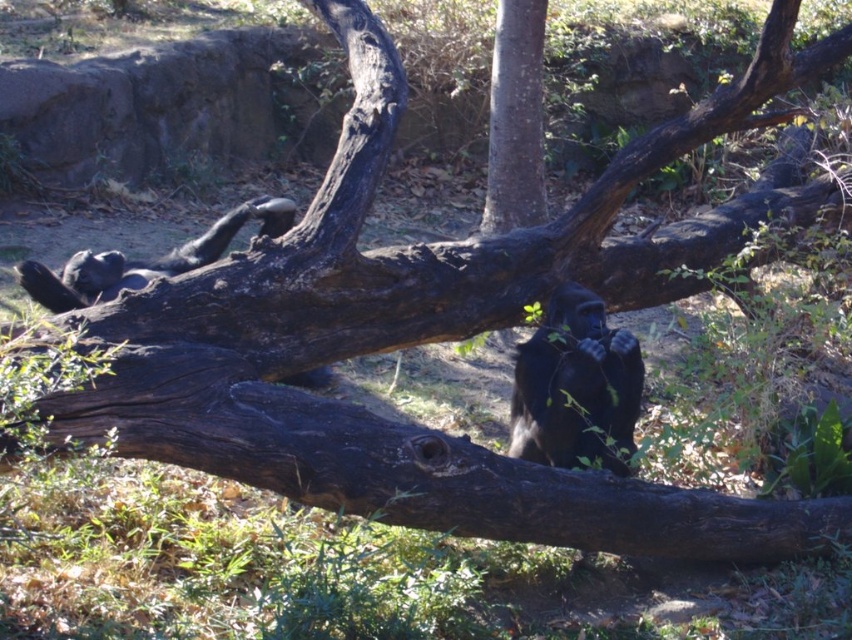
This screenshot has width=852, height=640. In order to click on shiny black ape at center in this screenshot , I will do `click(574, 387)`.

Describe the element at coordinates (574, 387) in the screenshot. I see `shiny black ape at center` at that location.

Which is in front, point (620, 358) or point (528, 42)?

Positioned in front is point (620, 358).

The height and width of the screenshot is (640, 852). Identify the location of shiny black ape at center. (574, 387).